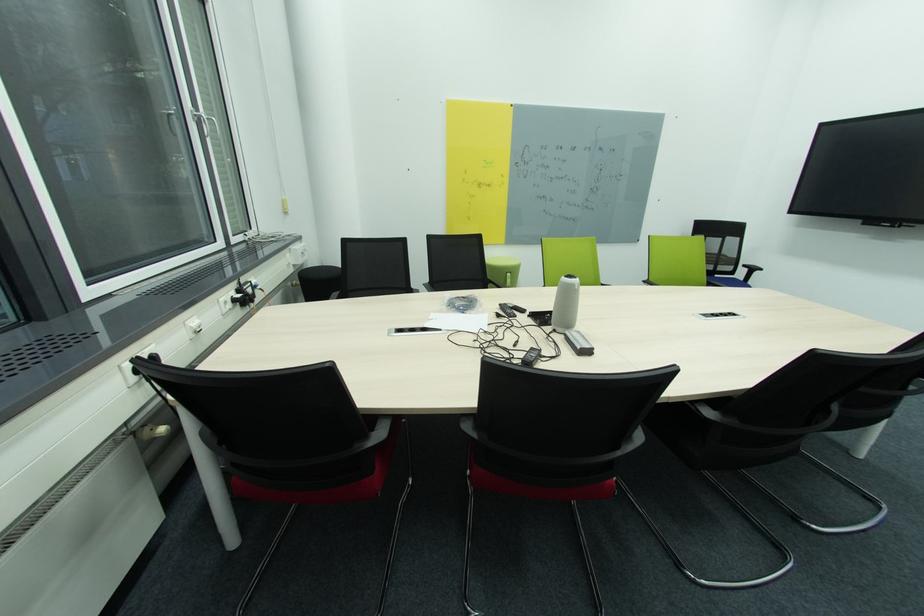
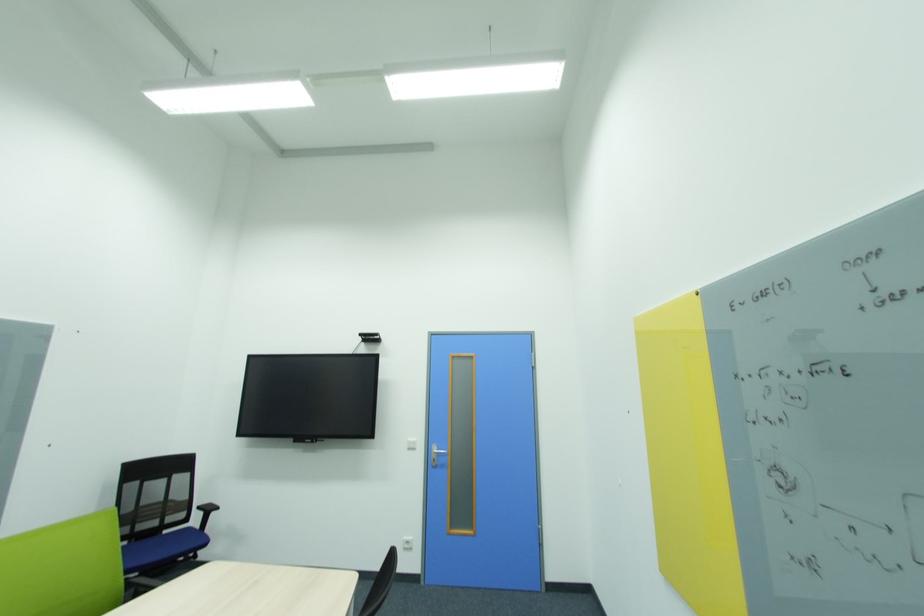
The first image is from the beginning of the video and the second image is from the end. How did the camera likely rotate when shooting the video?

The rotation direction of the camera is right-up.